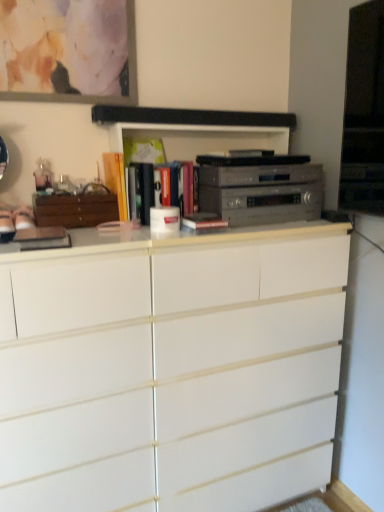
Question: Is hardcover book at center, which is the third book from left to right, wider or thinner than matte orange book at center, the fourth book positioned from the right?

Choices:
 (A) wide
 (B) thin

Answer: (A)

Question: Is point (142, 206) closer or farther from the camera than point (104, 177)?

Choices:
 (A) farther
 (B) closer

Answer: (B)

Question: Which object is the farthest from the silver metallic stereo at center?

Choices:
 (A) white matte chest of drawers at center
 (B) matte yellow book at center, which ranks as the third book in right-to-left order
 (C) matte glass picture frame at upper left
 (D) hardcover book at center, positioned as the 4th book in left-to-right order
 (E) wooden cabinet at left

Answer: (C)

Question: Which is farther from the silver metallic stereo at center?

Choices:
 (A) wooden cabinet at left
 (B) matte glass picture frame at upper left
 (C) hardcover book at center, positioned as the 4th book in left-to-right order
 (D) matte orange book at center, placed as the 1th book when sorted from left to right
 (E) white matte chest of drawers at center

Answer: (B)